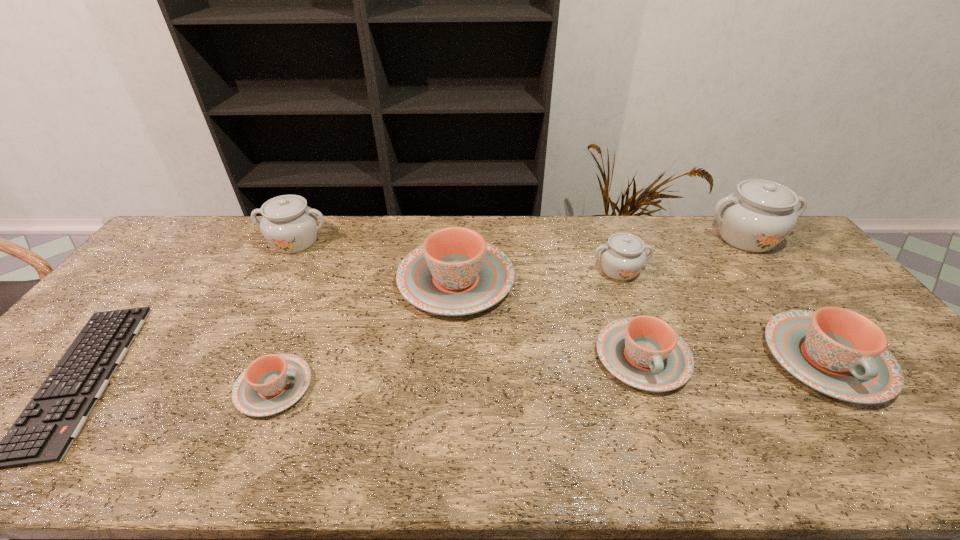
This screenshot has height=540, width=960. Identify the location of the second shortest object. (272, 383).

The width and height of the screenshot is (960, 540). I want to click on the shortest chinaware, so click(x=272, y=383).

Locate an element on the screen. free space located on the front of the tallest object is located at coordinates (785, 288).

You are a GUI agent. You are given a task and a screenshot of the screen. Output one action in this format:
    pyautogui.click(x=<x>, y=<y>)
    Task: Click on the vacant space located 0.060m on the left of the second biggest white chinaware
    This screenshot has width=960, height=540.
    Given the screenshot: What is the action you would take?
    pyautogui.click(x=243, y=241)

Image resolution: width=960 pixels, height=540 pixels. I want to click on vacant space situated on the handle side of the second pink chinaware from left to right, so click(x=459, y=228).

The height and width of the screenshot is (540, 960). I want to click on free location located on the handle side of the second pink chinaware from left to right, so click(x=459, y=230).

Identify the location of vacant region located on the handle side of the second pink chinaware from left to right. (459, 235).

Where is `free space located 0.380m on the left of the smallest white chinaware`? The height and width of the screenshot is (540, 960). free space located 0.380m on the left of the smallest white chinaware is located at coordinates (472, 270).

Locate an element on the screen. This screenshot has height=540, width=960. vacant space located on the handle side of the second biggest pink chinaware is located at coordinates (888, 442).

Identify the location of free space located on the handle side of the sixth tallest chinaware. The width and height of the screenshot is (960, 540). (678, 457).